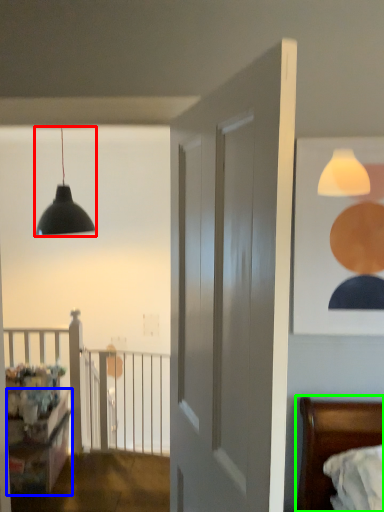
Question: Estimate the real-world distances between objects in this image. Which object is farther from lamp (highlighted by a red box), dresser (highlighted by a blue box) or bed (highlighted by a green box)?

Choices:
 (A) dresser
 (B) bed

Answer: (B)